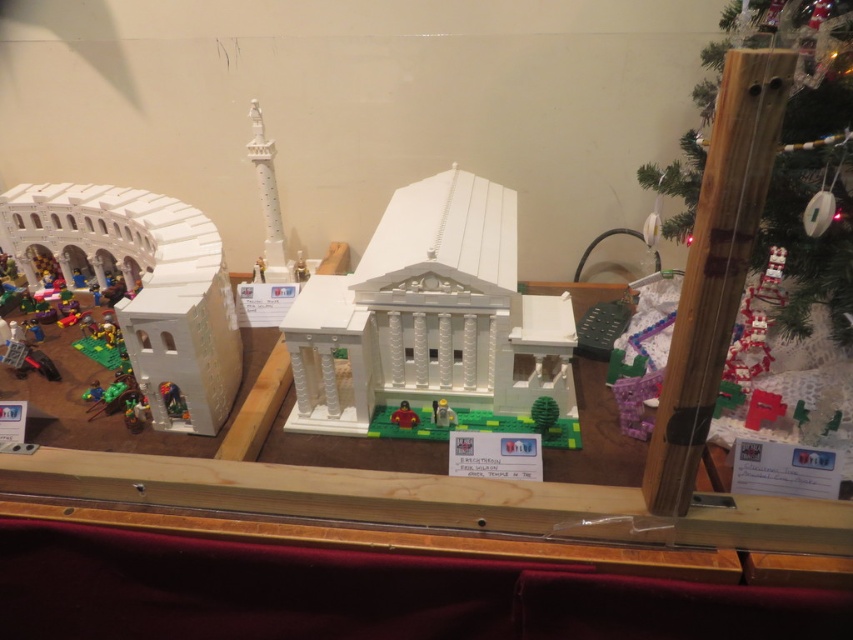
Question: From the image, what is the correct spatial relationship of white lego amphitheater at left in relation to wooden at right?

Choices:
 (A) above
 (B) below

Answer: (A)

Question: Is white lego amphitheater at left wider than matte white toy at center?

Choices:
 (A) yes
 (B) no

Answer: (A)

Question: Is green matte christmas tree at center above matte white toy at center?

Choices:
 (A) yes
 (B) no

Answer: (A)

Question: Estimate the real-world distances between objects in this image. Which object is farther from the white plastic figure at center?

Choices:
 (A) white lego amphitheater at left
 (B) matte white toy at center
 (C) wooden at right
 (D) green matte christmas tree at center

Answer: (A)

Question: Which is nearer to the green matte christmas tree at center?

Choices:
 (A) white plastic figure at center
 (B) green matte christmas tree at upper right
 (C) wooden at right
 (D) matte yellow toy at center

Answer: (B)

Question: Which object is positioned farthest from the wooden at right?

Choices:
 (A) white matte lego building at center
 (B) white lego amphitheater at left
 (C) white plastic figure at center
 (D) matte white toy at center

Answer: (B)